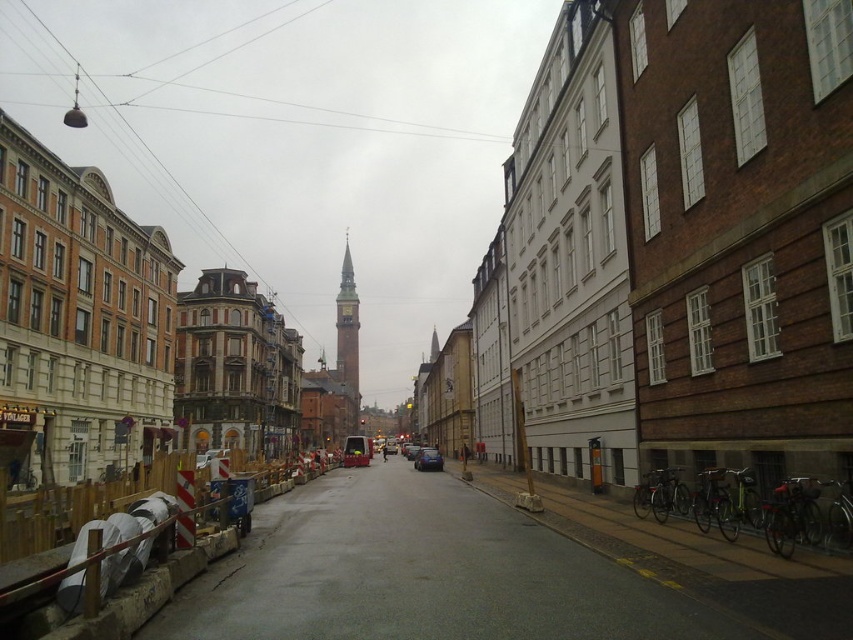
Which of these two, gold textured clock tower at center or metallic blue car at center, stands shorter?

With less height is metallic blue car at center.

Who is positioned more to the right, gold textured clock tower at center or metallic blue car at center?

metallic blue car at center

Is point (335, 301) farther from camera compared to point (415, 458)?

Yes, point (335, 301) is farther from viewer.

Locate an element on the screen. gold textured clock tower at center is located at coordinates (347, 337).